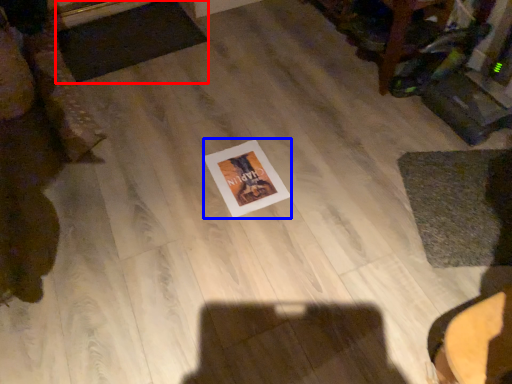
Question: Which of the following is the farthest to the observer, mat (highlighted by a red box) or postcard (highlighted by a blue box)?

Choices:
 (A) mat
 (B) postcard

Answer: (A)